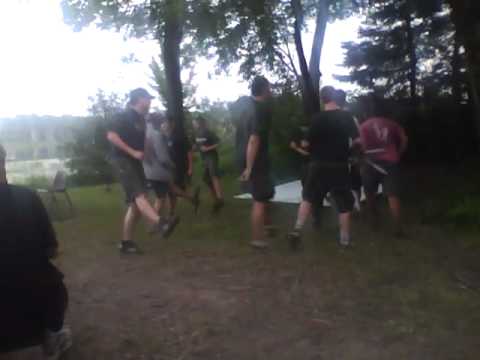
Image resolution: width=480 pixels, height=360 pixels. Find the location of `stone stool or bench of person sitting`. stone stool or bench of person sitting is located at coordinates (51, 348).